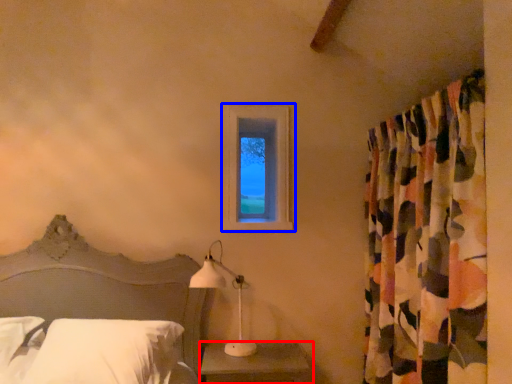
Question: Which point is further to the camera, nightstand (highlighted by a red box) or window (highlighted by a blue box)?

Choices:
 (A) nightstand
 (B) window

Answer: (B)